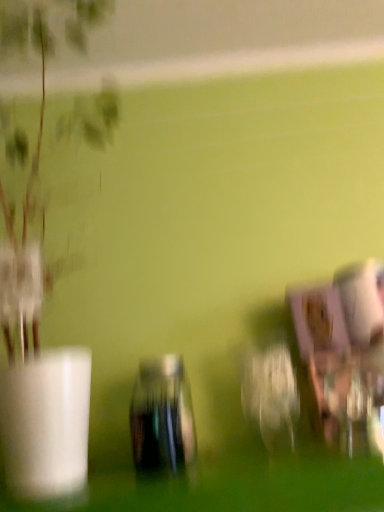
Where is `green leafy plant at left`? Image resolution: width=384 pixels, height=512 pixels. green leafy plant at left is located at coordinates click(39, 365).

This screenshot has width=384, height=512. Describe the element at coordinates (39, 365) in the screenshot. I see `green leafy plant at left` at that location.

Measure the distance between point [27,467] and camera.

The distance of point [27,467] from camera is 19.53 inches.

Measure the distance between green leafy plant at left and camera.

The depth of green leafy plant at left is 19.52 inches.

Identify the location of green leafy plant at left. This screenshot has width=384, height=512. (39, 365).